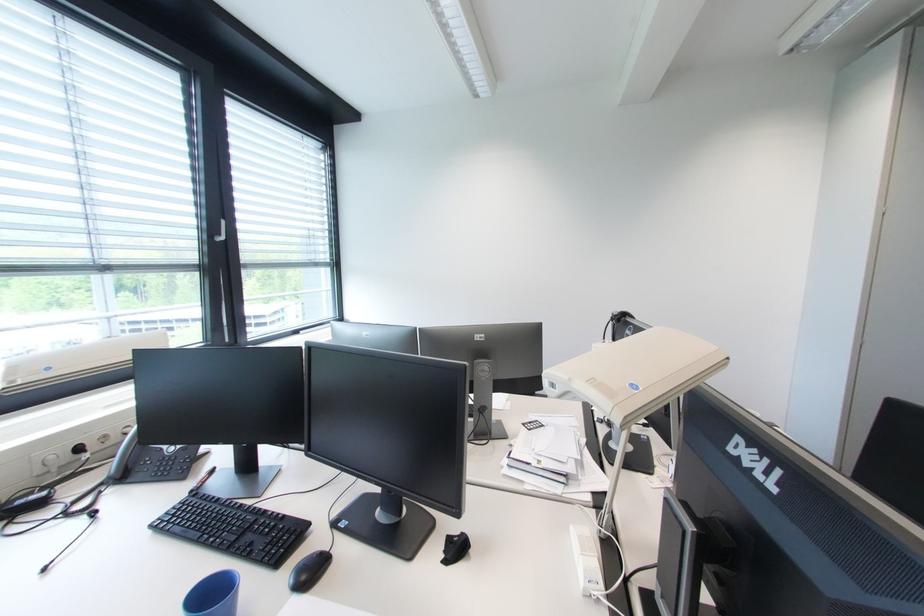
Describe the element at coordinates (636, 373) in the screenshot. This screenshot has height=616, width=924. I see `a document camera head` at that location.